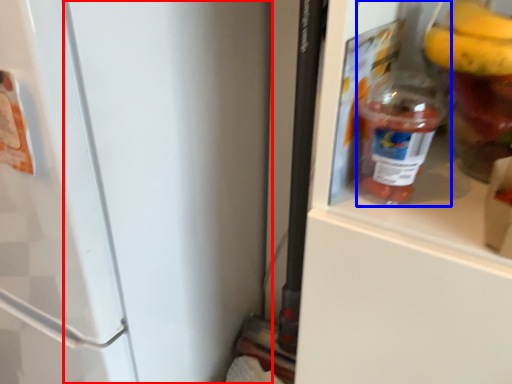
Question: Which object appears closest to the camera in this image, door (highlighted by a red box) or bottle (highlighted by a blue box)?

Choices:
 (A) door
 (B) bottle

Answer: (A)